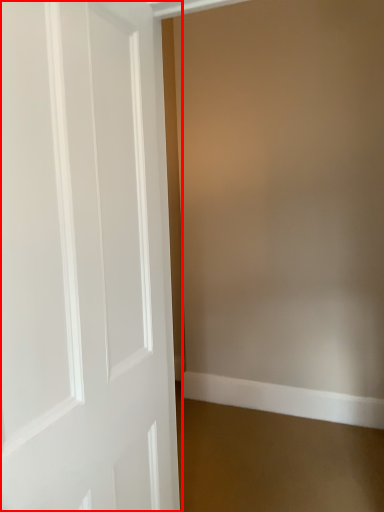
Question: From the image, what is the correct spatial relationship of door (annotated by the red box) in relation to molding?

Choices:
 (A) right
 (B) left

Answer: (B)